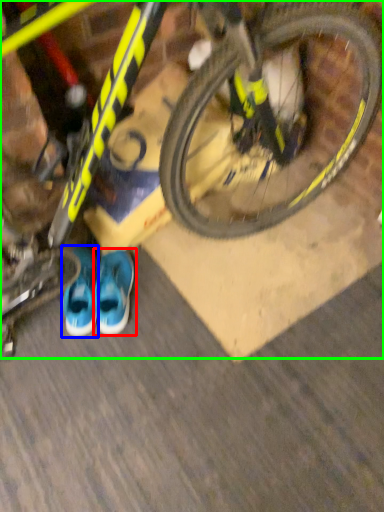
Question: Which object is positioned farthest from running shoe (highlighted by a red box)? Select from footwear (highlighted by a blue box) and bicycle (highlighted by a green box).

Choices:
 (A) footwear
 (B) bicycle

Answer: (B)